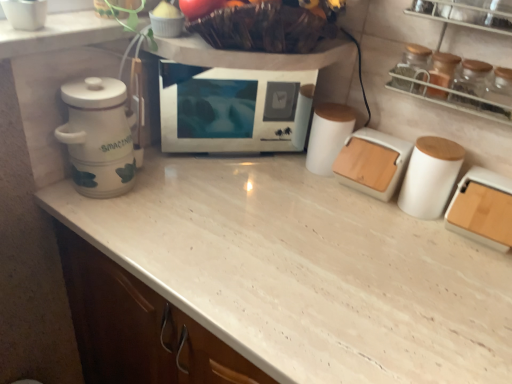
Question: From a real-world perspective, is transparent glass jars at upper right on transparent glass jar at upper right?

Choices:
 (A) no
 (B) yes

Answer: (B)

Question: From the image's perspective, is transparent glass jars at upper right under transparent glass jar at upper right?

Choices:
 (A) yes
 (B) no

Answer: (B)

Question: Is transparent glass jars at upper right surrounding transparent glass jar at upper right?

Choices:
 (A) no
 (B) yes

Answer: (B)

Question: Can you confirm if transparent glass jars at upper right is wider than transparent glass jar at upper right?

Choices:
 (A) no
 (B) yes

Answer: (B)

Question: From a real-world perspective, does transparent glass jars at upper right sit lower than transparent glass jar at upper right?

Choices:
 (A) yes
 (B) no

Answer: (B)

Question: From a real-world perspective, is white matte bread bin at center-right, acting as the 1th kitchen appliance starting from the left, positioned above or below transparent glass jar at upper right?

Choices:
 (A) below
 (B) above

Answer: (A)

Question: Is point (355, 173) positioned closer to the camera than point (496, 92)?

Choices:
 (A) farther
 (B) closer

Answer: (A)

Question: Looking at the image, does white matte bread bin at center-right, acting as the 1th kitchen appliance starting from the left, seem bigger or smaller compared to transparent glass jar at upper right?

Choices:
 (A) small
 (B) big

Answer: (B)

Question: Relative to transparent glass jar at upper right, is white matte bread bin at center-right, marked as the third kitchen appliance in a right-to-left arrangement, in front or behind?

Choices:
 (A) front
 (B) behind

Answer: (B)

Question: In terms of height, does white ceramic canister at left look taller or shorter compared to wooden lid container at right, placed as the first kitchen appliance when sorted from right to left?

Choices:
 (A) short
 (B) tall

Answer: (B)

Question: Based on their positions, is white ceramic canister at left located to the left or right of wooden lid container at right, placed as the first kitchen appliance when sorted from right to left?

Choices:
 (A) left
 (B) right

Answer: (A)

Question: Would you say white ceramic canister at left is inside or outside wooden lid container at right, placed as the first kitchen appliance when sorted from right to left?

Choices:
 (A) inside
 (B) outside

Answer: (B)

Question: Is point (116, 130) positioned closer to the camera than point (500, 233)?

Choices:
 (A) closer
 (B) farther

Answer: (B)

Question: From a real-world perspective, is transparent glass jar at upper right physically located above or below white ceramic canister at left?

Choices:
 (A) above
 (B) below

Answer: (A)

Question: Considering the positions of transparent glass jar at upper right and white ceramic canister at left in the image, is transparent glass jar at upper right taller or shorter than white ceramic canister at left?

Choices:
 (A) short
 (B) tall

Answer: (A)